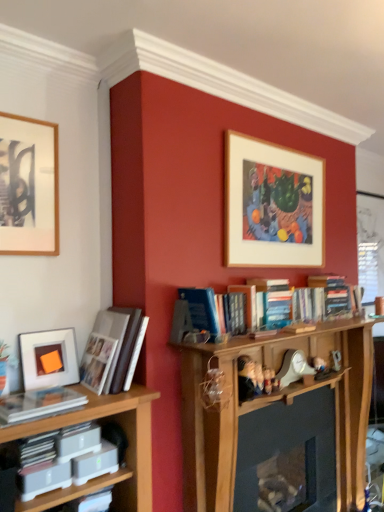
Question: Is wooden picture frame at upper center, acting as the 3th picture frame starting from the front, facing away from matte white paperback book at lower left?

Choices:
 (A) yes
 (B) no

Answer: (B)

Question: From the image's perspective, is wooden picture frame at upper center, acting as the third picture frame starting from the left, over matte white paperback book at lower left?

Choices:
 (A) yes
 (B) no

Answer: (A)

Question: Is wooden picture frame at upper center, which is the 1th picture frame in back-to-front order, at the left side of matte white paperback book at lower left?

Choices:
 (A) yes
 (B) no

Answer: (B)

Question: From a real-world perspective, is wooden picture frame at upper center, the 1th picture frame in the right-to-left sequence, located higher than matte white paperback book at lower left?

Choices:
 (A) no
 (B) yes

Answer: (B)

Question: From the image's perspective, is wooden picture frame at upper center, acting as the third picture frame starting from the left, below matte white paperback book at lower left?

Choices:
 (A) yes
 (B) no

Answer: (B)

Question: Is white mesh screen at right spatially inside matte white paperback book at lower left, or outside of it?

Choices:
 (A) outside
 (B) inside

Answer: (A)

Question: Is white mesh screen at right wider or thinner than matte white paperback book at lower left?

Choices:
 (A) wide
 (B) thin

Answer: (B)

Question: Does point (x=380, y=226) appear closer or farther from the camera than point (x=112, y=456)?

Choices:
 (A) closer
 (B) farther

Answer: (B)

Question: From their relative heights in the image, would you say white mesh screen at right is taller or shorter than matte white paperback book at lower left?

Choices:
 (A) tall
 (B) short

Answer: (A)

Question: In the image, is clear plastic book at lower left, the first book from the bottom, positioned in front of or behind wooden picture frame at upper left, positioned as the 1th picture frame in left-to-right order?

Choices:
 (A) behind
 (B) front

Answer: (B)

Question: From their relative heights in the image, would you say clear plastic book at lower left, arranged as the second book when viewed from the back, is taller or shorter than wooden picture frame at upper left, positioned as the 1th picture frame in left-to-right order?

Choices:
 (A) tall
 (B) short

Answer: (B)

Question: Is clear plastic book at lower left, the first book from the bottom, inside the boundaries of wooden picture frame at upper left, which appears as the 2th picture frame when viewed from the front, or outside?

Choices:
 (A) outside
 (B) inside

Answer: (A)

Question: From the image's perspective, relative to wooden picture frame at upper left, which appears as the 2th picture frame when viewed from the front, is clear plastic book at lower left, the first book from the bottom, above or below?

Choices:
 (A) below
 (B) above

Answer: (A)

Question: Considering the positions of white glossy photo album at left, which appears as the 2th book when viewed from the front, and white plastic toy at center in the image, is white glossy photo album at left, which appears as the 2th book when viewed from the front, bigger or smaller than white plastic toy at center?

Choices:
 (A) big
 (B) small

Answer: (A)

Question: Looking at their shapes, would you say white glossy photo album at left, positioned as the first book in top-to-bottom order, is wider or thinner than white plastic toy at center?

Choices:
 (A) thin
 (B) wide

Answer: (B)